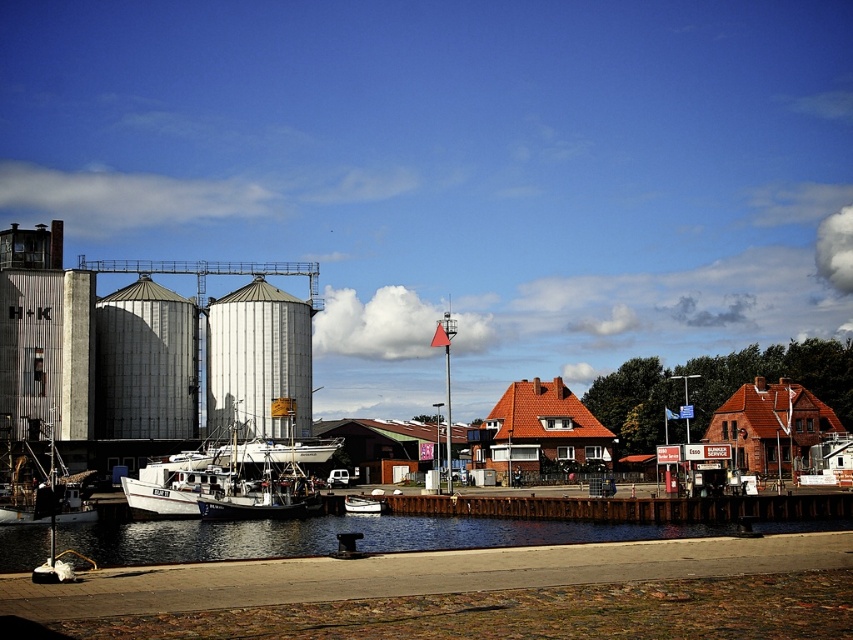
You are a boat inspector standing on the dock. You need to determine which boat is taller between the white matte boat at center and the white wooden boat at center. According to the scene description, which one is taller?

The white matte boat at center is taller than the white wooden boat at center.

You are a dock worker who needs to inspect both the white matte boat at center and the white wooden boat at center. Since they are both at the center, how can you determine which boat to approach first?

The white matte boat at center is positioned over the white wooden boat at center, so you should approach the white wooden boat at center first as it is underneath and might be less accessible otherwise.

You are standing at the starting point of the walkway and want to board the brown wooden dock at center. Based on the coordinates provided, in which direction should you walk to reach the dock?

The brown wooden dock at center is located at point (630, 508). Since coordinates typically increase from the bottom left corner, moving towards higher x and y values would mean walking northeast to reach the dock.